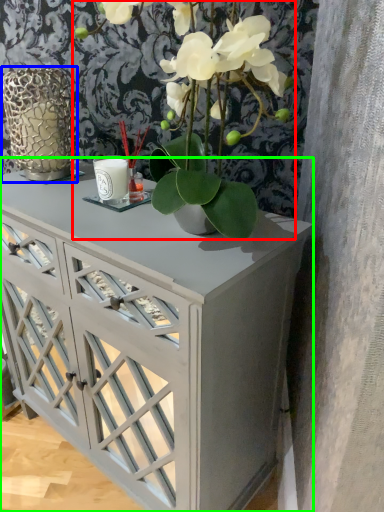
Question: Estimate the real-world distances between objects in this image. Which object is closer to houseplant (highlighted by a red box), glass vase (highlighted by a blue box) or table (highlighted by a green box)?

Choices:
 (A) glass vase
 (B) table

Answer: (B)